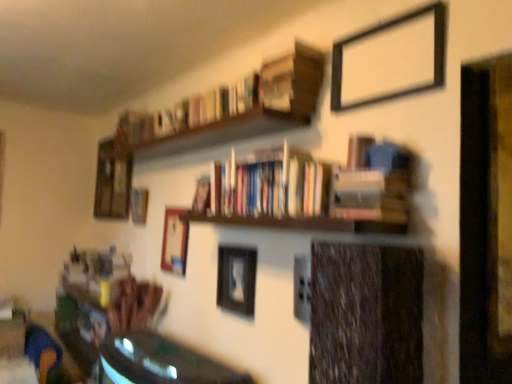
Question: Is black matte picture frame at upper right, the 5th picture frame viewed from the back, at the back of wooden picture frame at upper left, positioned as the 5th picture frame in front-to-back order?

Choices:
 (A) yes
 (B) no

Answer: (B)

Question: Is wooden picture frame at upper left, placed as the 2th picture frame when sorted from back to front, closer to the viewer compared to black matte picture frame at upper right, the 5th picture frame positioned from the left?

Choices:
 (A) yes
 (B) no

Answer: (B)

Question: Is wooden picture frame at upper left, positioned as the 5th picture frame in front-to-back order, thinner than black matte picture frame at upper right, the 5th picture frame positioned from the left?

Choices:
 (A) yes
 (B) no

Answer: (B)

Question: Is the depth of wooden picture frame at upper left, which appears as the second picture frame when viewed from the left, greater than that of black matte picture frame at upper right, the 5th picture frame viewed from the back?

Choices:
 (A) no
 (B) yes

Answer: (B)

Question: Considering the relative sizes of wooden picture frame at upper left, positioned as the 5th picture frame in front-to-back order, and black matte picture frame at upper right, which ranks as the 2th picture frame in right-to-left order, in the image provided, is wooden picture frame at upper left, positioned as the 5th picture frame in front-to-back order, shorter than black matte picture frame at upper right, which ranks as the 2th picture frame in right-to-left order,?

Choices:
 (A) yes
 (B) no

Answer: (A)

Question: Based on their sizes in the image, would you say wooden picture frame at upper left, which appears as the second picture frame when viewed from the left, is bigger or smaller than wooden picture frame at upper left, marked as the sixth picture frame in a right-to-left arrangement?

Choices:
 (A) big
 (B) small

Answer: (B)

Question: Is wooden picture frame at upper left, which appears as the second picture frame when viewed from the left, inside the boundaries of wooden picture frame at upper left, acting as the first picture frame starting from the back, or outside?

Choices:
 (A) inside
 (B) outside

Answer: (B)

Question: Is wooden picture frame at upper left, which appears as the second picture frame when viewed from the left, wider or thinner than wooden picture frame at upper left, the sixth picture frame from the front?

Choices:
 (A) thin
 (B) wide

Answer: (B)

Question: Visually, is wooden picture frame at upper left, placed as the 2th picture frame when sorted from back to front, positioned to the left or to the right of wooden picture frame at upper left, the 1th picture frame positioned from the left?

Choices:
 (A) right
 (B) left

Answer: (A)

Question: Considering the positions of shiny green table at lower left and black matte picture frame at upper right, which ranks as the 2th picture frame in right-to-left order, in the image, is shiny green table at lower left taller or shorter than black matte picture frame at upper right, which ranks as the 2th picture frame in right-to-left order,?

Choices:
 (A) short
 (B) tall

Answer: (B)

Question: Is shiny green table at lower left wider or thinner than black matte picture frame at upper right, the 5th picture frame viewed from the back?

Choices:
 (A) thin
 (B) wide

Answer: (B)

Question: From a real-world perspective, is shiny green table at lower left positioned above or below black matte picture frame at upper right, the 5th picture frame viewed from the back?

Choices:
 (A) above
 (B) below

Answer: (B)

Question: Do you think shiny green table at lower left is within black matte picture frame at upper right, which is the second picture frame in front-to-back order, or outside of it?

Choices:
 (A) outside
 (B) inside

Answer: (A)

Question: Is point (176, 221) closer or farther from the camera than point (158, 114)?

Choices:
 (A) farther
 (B) closer

Answer: (B)

Question: Considering their positions, is wooden picture frame at center, the 4th picture frame positioned from the right, located in front of or behind hardcover books at upper center, which is counted as the first book, starting from the top?

Choices:
 (A) front
 (B) behind

Answer: (B)